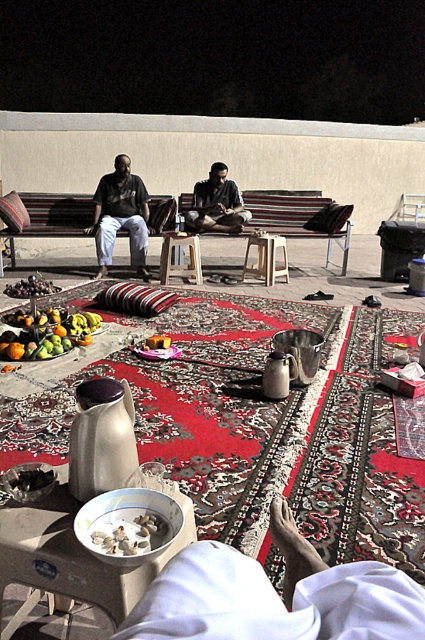
Question: Which point is closer to the camera taking this photo?

Choices:
 (A) (112, 216)
 (B) (163, 266)

Answer: (B)

Question: Can you confirm if matte black shirt at left is bigger than dark brown nuts at center-left?

Choices:
 (A) yes
 (B) no

Answer: (A)

Question: From the image, what is the correct spatial relationship of white fabric at lower center in relation to dark brown nuts at center-left?

Choices:
 (A) left
 (B) right

Answer: (B)

Question: Does shiny metallic bowl at center have a greater width compared to wooden stool at center?

Choices:
 (A) yes
 (B) no

Answer: (A)

Question: Which point is farther to the camera?

Choices:
 (A) white fabric at lower center
 (B) dark brown nuts at center-left

Answer: (B)

Question: Which point appears closest to the camera in this image?

Choices:
 (A) (238, 230)
 (B) (132, 234)
 (C) (198, 264)
 (D) (244, 602)

Answer: (D)